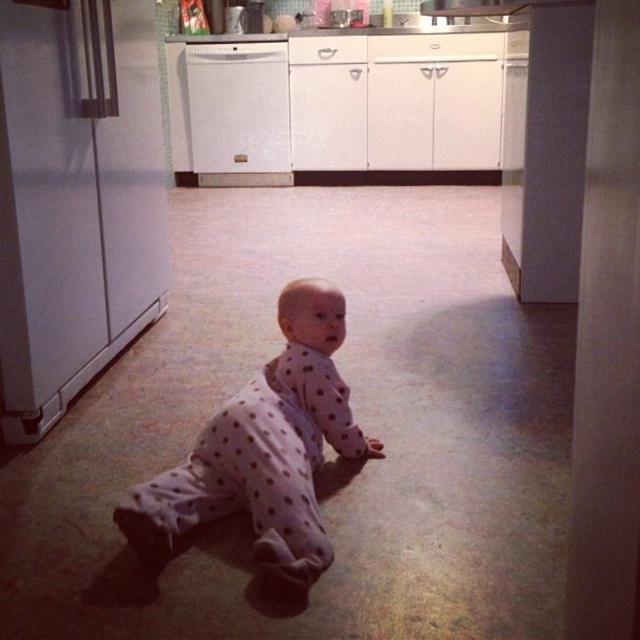
Question: Can you confirm if white polka dot onesie at center is positioned to the right of white glossy dishwasher at center?

Choices:
 (A) yes
 (B) no

Answer: (A)

Question: Is white polka dot onesie at center below white glossy dishwasher at center?

Choices:
 (A) no
 (B) yes

Answer: (B)

Question: Is white polka dot onesie at center in front of white glossy dishwasher at center?

Choices:
 (A) no
 (B) yes

Answer: (B)

Question: Which of the following is the closest to the observer?

Choices:
 (A) white polka dot onesie at center
 (B) white glossy dishwasher at center

Answer: (A)

Question: Which point appears closest to the camera in this image?

Choices:
 (A) (141, 497)
 (B) (202, 70)

Answer: (A)